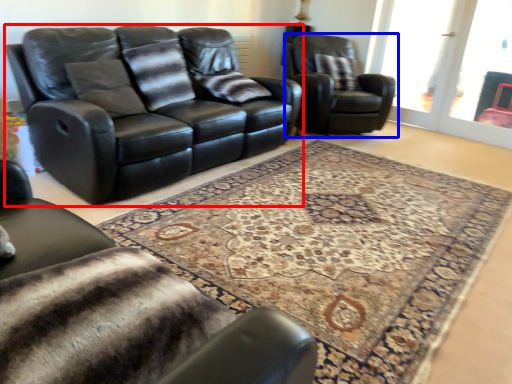
Question: Which object is closer to the camera taking this photo, studio couch (highlighted by a red box) or chair (highlighted by a blue box)?

Choices:
 (A) studio couch
 (B) chair

Answer: (A)